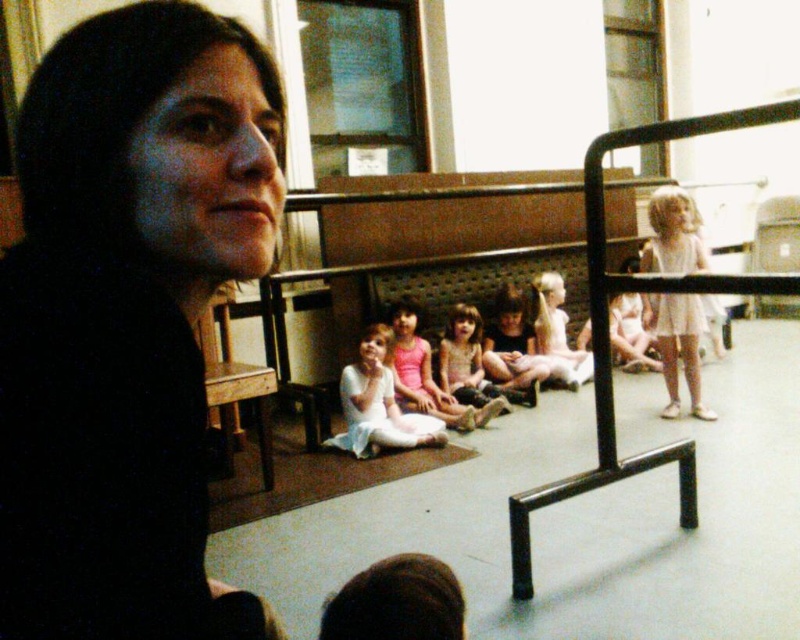
Question: Can you confirm if white satin dress at center is positioned to the right of smooth white dress at center?

Choices:
 (A) yes
 (B) no

Answer: (B)

Question: Which is farther from the matte pink dress at center?

Choices:
 (A) white cotton dress at right
 (B) black matte hair at upper left

Answer: (B)

Question: Does black matte hair at upper left appear under matte pink dress at center?

Choices:
 (A) no
 (B) yes

Answer: (A)

Question: Which of these objects is positioned closest to the smooth white dress at center?

Choices:
 (A) white cotton dress at right
 (B) pink fabric dress at center

Answer: (B)

Question: Among these objects, which one is nearest to the camera?

Choices:
 (A) white satin dress at center
 (B) pink fabric dress at center
 (C) black matte hair at upper left
 (D) white cotton dress at right

Answer: (C)

Question: Does white cotton dress at right have a smaller size compared to pink fabric dress at center?

Choices:
 (A) yes
 (B) no

Answer: (B)